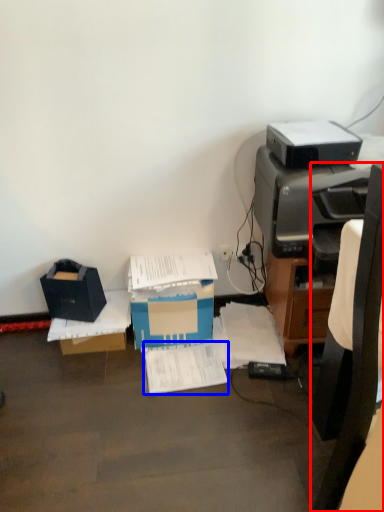
Question: Among these objects, which one is farthest to the camera, chair (highlighted by a red box) or document (highlighted by a blue box)?

Choices:
 (A) chair
 (B) document

Answer: (B)